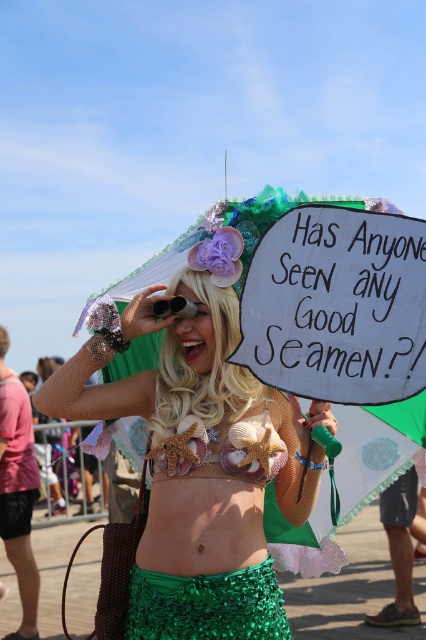
Who is shorter, blonde hair wig at center or seashell bikini top at center?

With less height is seashell bikini top at center.

Can you confirm if blonde hair wig at center is positioned below seashell bikini top at center?

Actually, blonde hair wig at center is above seashell bikini top at center.

Does point (227, 292) lie behind point (250, 433)?

Yes, point (227, 292) is behind point (250, 433).

Image resolution: width=426 pixels, height=640 pixels. Find the location of `blonde hair wig at center`. blonde hair wig at center is located at coordinates (x=201, y=358).

Is green sequined skirt at lower center below seashell bikini top at center?

Yes, green sequined skirt at lower center is below seashell bikini top at center.

Who is higher up, green sequined skirt at lower center or seashell bikini top at center?

Positioned higher is seashell bikini top at center.

What do you see at coordinates (198, 467) in the screenshot?
I see `green sequined skirt at lower center` at bounding box center [198, 467].

This screenshot has height=640, width=426. I want to click on green sequined skirt at lower center, so click(x=198, y=467).

Measure the distance between point [296,488] and camera.

Point [296,488] is 4.24 meters away from camera.

Can you confirm if green sequined skirt at lower center is bigger than blonde hair wig at center?

Indeed, green sequined skirt at lower center has a larger size compared to blonde hair wig at center.

Locate an element on the screen. Image resolution: width=426 pixels, height=640 pixels. green sequined skirt at lower center is located at coordinates (198, 467).

Locate an element on the screen. green sequined skirt at lower center is located at coordinates (198, 467).